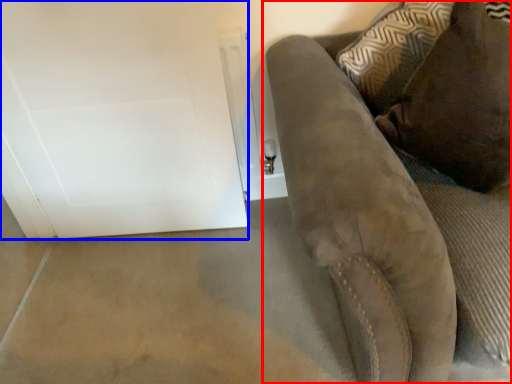
Question: Which of the following is the farthest to the observer, furniture (highlighted by a red box) or glass door (highlighted by a blue box)?

Choices:
 (A) furniture
 (B) glass door

Answer: (B)